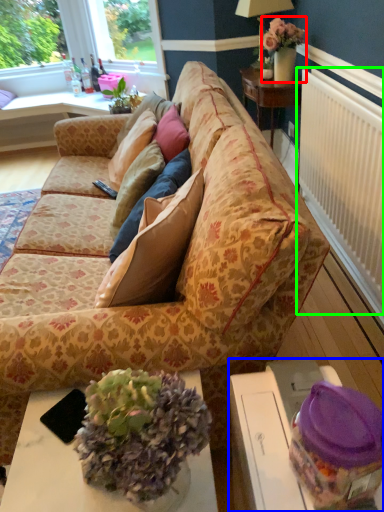
Question: Considering the real-world distances, which object is farthest from houseplant (highlighted by a red box)? table (highlighted by a blue box) or radiator (highlighted by a green box)?

Choices:
 (A) table
 (B) radiator

Answer: (A)